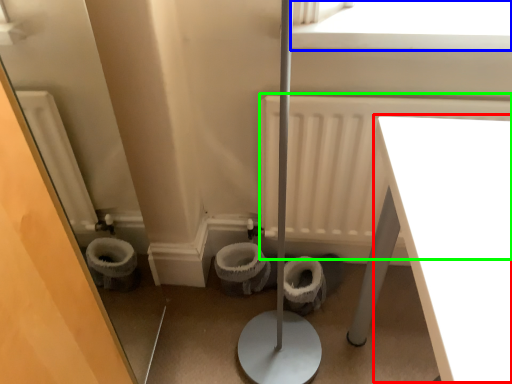
Question: Which object is positioned closest to table (highlighted by a red box)? Select from window screen (highlighted by a blue box) and radiator (highlighted by a green box).

Choices:
 (A) window screen
 (B) radiator

Answer: (A)